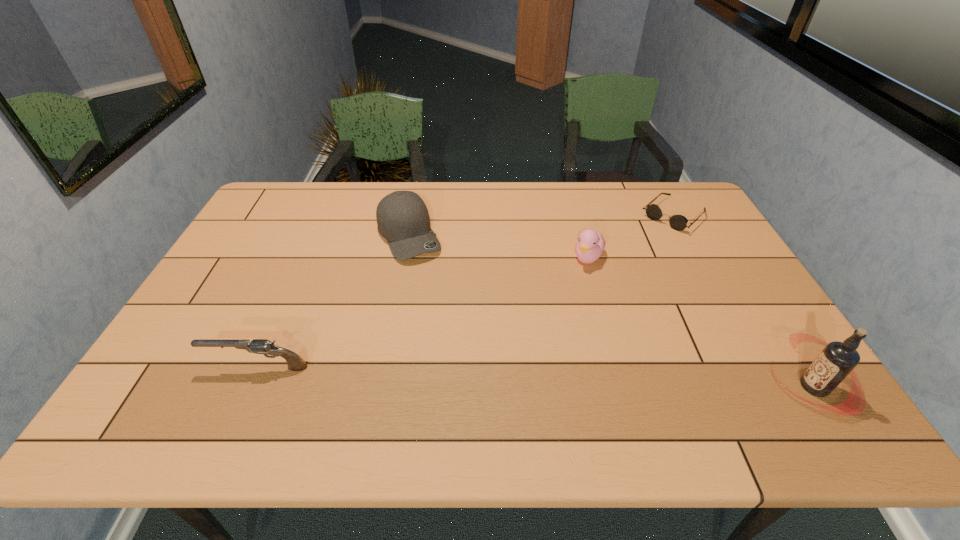
In order to click on free area in between the duckling and the sunglasses in this screenshot , I will do `click(632, 236)`.

Find the location of a particular element. vacant area that lies between the baseball cap and the leftmost object is located at coordinates pos(333,301).

The image size is (960, 540). Identify the location of vacant area between the tallest object and the baseball cap. (612, 311).

At what (x,y) coordinates should I click in order to perform the action: click on vacant region between the sunglasses and the root beer. Please return your answer as a coordinate pair (x, y). Looking at the image, I should click on (744, 301).

Identify the location of free spot between the tallest object and the gun. The width and height of the screenshot is (960, 540). (536, 377).

At what (x,y) coordinates should I click in order to perform the action: click on vacant space in between the gun and the fourth object from right to left. Please return your answer as a coordinate pair (x, y). Looking at the image, I should click on (333, 301).

Locate an element on the screen. free space between the leftmost object and the third object from left to right is located at coordinates (423, 312).

Identify which object is the third nearest to the gun. Please provide its 2D coordinates. Your answer should be formatted as a tuple, i.e. [(x, y)], where the tuple contains the x and y coordinates of a point satisfying the conditions above.

[(678, 222)]

Choose which object is the second nearest neighbor to the second object from left to right. Please provide its 2D coordinates. Your answer should be formatted as a tuple, i.e. [(x, y)], where the tuple contains the x and y coordinates of a point satisfying the conditions above.

[(591, 244)]

Where is `vacant region that satisfies the following two spatial constraints: 1. on the front side of the sunglasses; 2. on the label of the tallest object`? The height and width of the screenshot is (540, 960). vacant region that satisfies the following two spatial constraints: 1. on the front side of the sunglasses; 2. on the label of the tallest object is located at coordinates (769, 387).